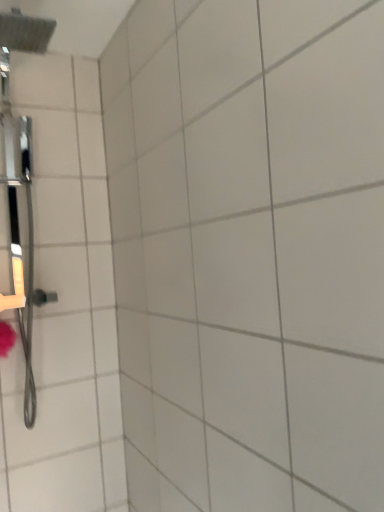
Question: Should I look upward or downward to see white ceramic tile at center?

Choices:
 (A) down
 (B) up

Answer: (A)